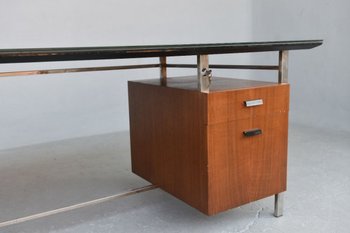
The image size is (350, 233). I want to click on white walls, so click(159, 23), click(288, 20).